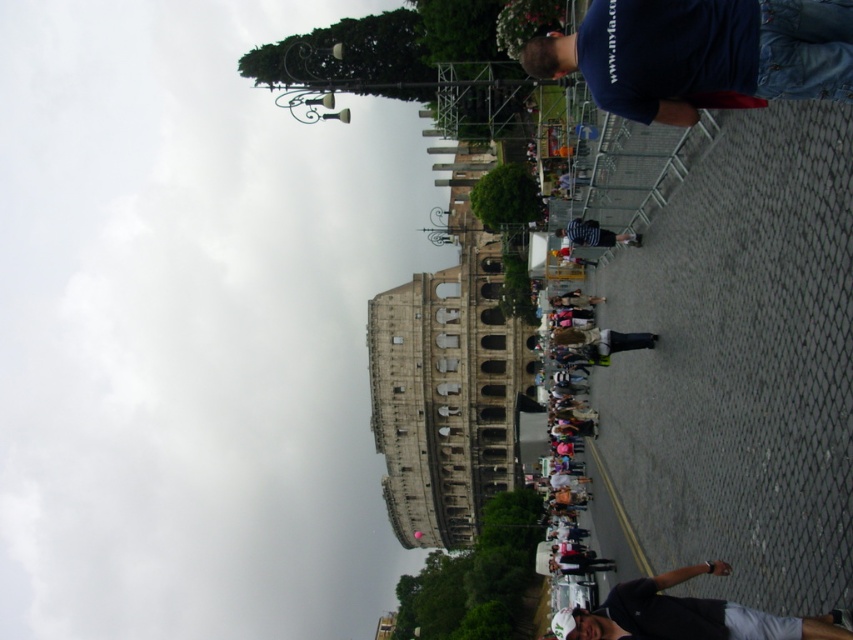
Question: Among these objects, which one is farthest from the camera?

Choices:
 (A) gray cotton t-shirt at lower right
 (B) dark blue t-shirt at upper right
 (C) striped cotton shirt at center

Answer: (C)

Question: Among these objects, which one is farthest from the camera?

Choices:
 (A) gray cotton t-shirt at lower right
 (B) dark blue t-shirt at upper right

Answer: (B)

Question: Is dark blue t-shirt at upper right above striped cotton shirt at center?

Choices:
 (A) no
 (B) yes

Answer: (B)

Question: Which is farther from the striped cotton shirt at center?

Choices:
 (A) gray cotton t-shirt at lower right
 (B) dark blue t-shirt at upper right

Answer: (A)

Question: Does gray cotton t-shirt at lower right lie behind striped cotton shirt at center?

Choices:
 (A) no
 (B) yes

Answer: (A)

Question: Is dark blue t-shirt at upper right to the right of striped cotton shirt at center from the viewer's perspective?

Choices:
 (A) yes
 (B) no

Answer: (B)